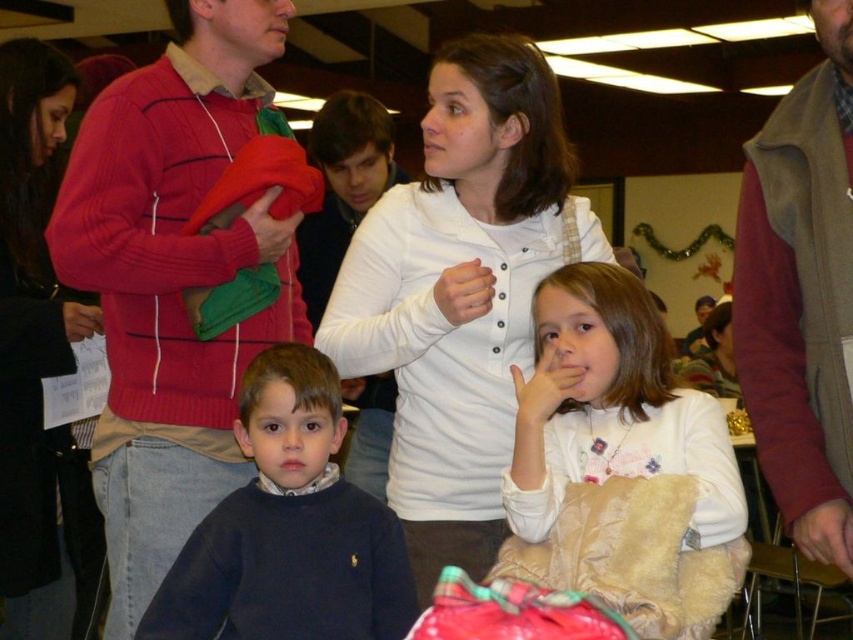
Question: Which point appears closest to the camera in this image?

Choices:
 (A) (589, 531)
 (B) (73, 320)
 (C) (347, 531)

Answer: (A)

Question: Can you confirm if matte black jacket at upper left is thinner than matte red sweater at upper center?

Choices:
 (A) no
 (B) yes

Answer: (A)

Question: Which of these objects is positioned farthest from the white fluffy jacket at center?

Choices:
 (A) matte red sweater at left
 (B) velvet maroon vest at right
 (C) dark blue sweater at center

Answer: (A)

Question: Is matte black jacket at upper left bigger than matte white hand at center?

Choices:
 (A) no
 (B) yes

Answer: (B)

Question: Which point is farther from the camera taking this photo?

Choices:
 (A) (283, 234)
 (B) (822, 180)
 (C) (514, 429)
 (D) (361, 179)

Answer: (D)

Question: Does dark blue sweater at center have a greater width compared to matte white hand at center?

Choices:
 (A) yes
 (B) no

Answer: (A)